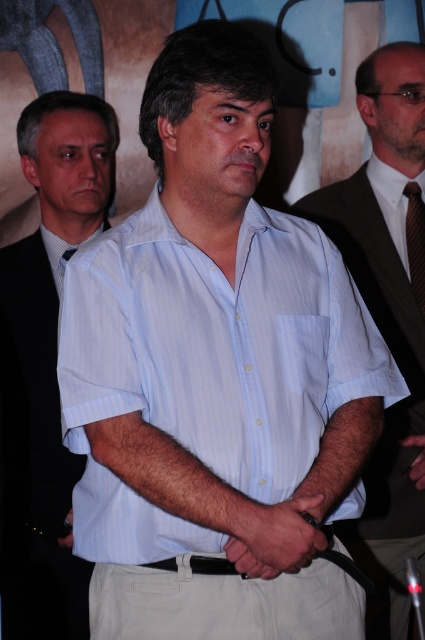
You are a photographer at the event. You need to adjust the lighting to ensure both the white striped shirt at center and the black leather hand at center are visible. Which object should you focus on first to ensure proper exposure?

The white striped shirt at center is located above the black leather hand at center, so focusing on the white striped shirt at center first will help balance the exposure for both objects.

You are a photographer standing at the event. You want to take a closeup shot of the smooth skin hands at center. What is the minimum distance you need to move forward to get the shot?

The smooth skin hands at center are 1.40 meters away from the viewer. To take a closeup shot, you need to move forward until you are within the desired framing distance, but the minimum distance required is at least 1.40 meters from the current position.

From the picture: You are at a networking event and see the light blue striped shirt at center and the smooth skin hands at center. Which object is positioned to the right side?

The light blue striped shirt at center is to the right of the smooth skin hands at center.